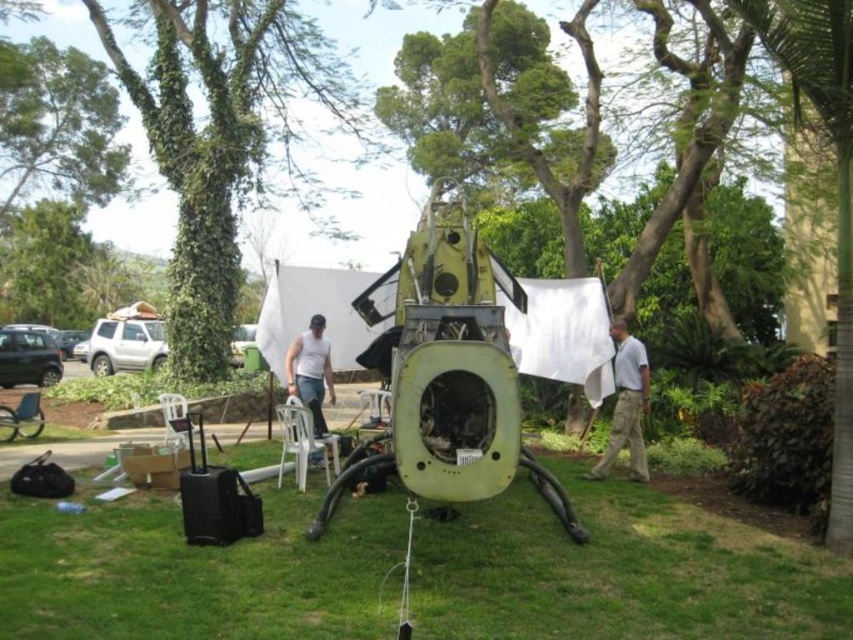
Question: Which of the following is the farthest from the observer?

Choices:
 (A) (207, 64)
 (B) (624, 410)
 (C) (314, 396)

Answer: (A)

Question: Which of the following is the closest to the observer?

Choices:
 (A) (300, 396)
 (B) (18, 141)

Answer: (A)

Question: Is green ivy-covered tree at upper left above white cotton shirt at center?

Choices:
 (A) yes
 (B) no

Answer: (A)

Question: Based on their relative distances, which object is farther from the white cotton shirt at center?

Choices:
 (A) white matte tank top at center
 (B) green grass at center
 (C) green ivy-covered tree at upper left
 (D) green leafy tree at upper left

Answer: (D)

Question: Does white cotton shirt at center come behind white matte tank top at center?

Choices:
 (A) no
 (B) yes

Answer: (A)

Question: Can you confirm if green leafy tree at upper left is wider than white matte tank top at center?

Choices:
 (A) no
 (B) yes

Answer: (B)